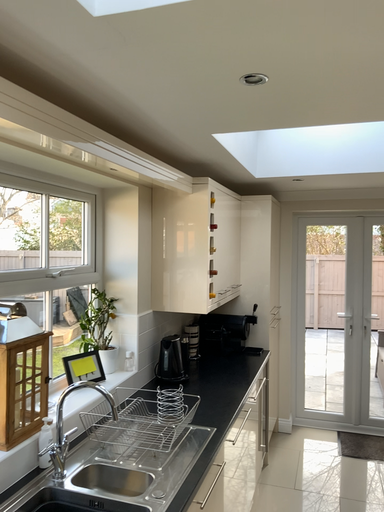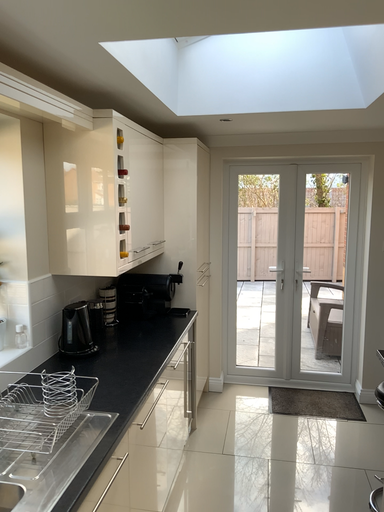
Question: How did the camera likely rotate when shooting the video?

Choices:
 (A) rotated left
 (B) rotated right

Answer: (B)